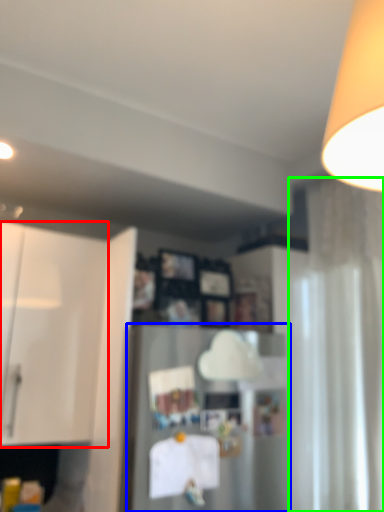
Question: Considering the real-world distances, which object is farthest from cabinetry (highlighted by a red box)? appliance (highlighted by a blue box) or curtain (highlighted by a green box)?

Choices:
 (A) appliance
 (B) curtain

Answer: (B)